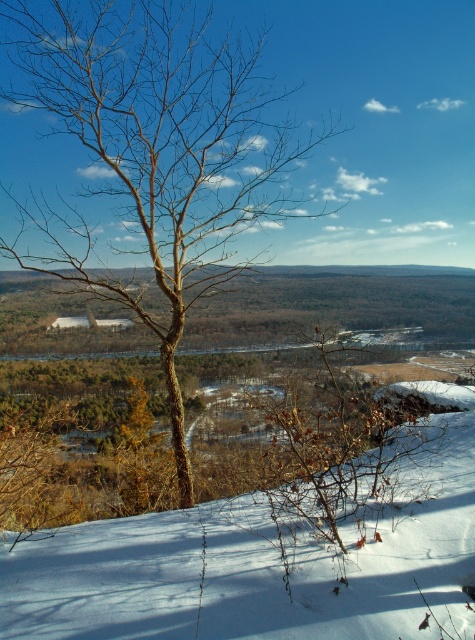
Between bare wood tree at center and white powdery snow at center, which one appears on the left side from the viewer's perspective?

bare wood tree at center

Between point (209, 118) and point (233, 512), which one is positioned behind?

Point (209, 118)

At what (x,y) coordinates should I click in order to perform the action: click on bare wood tree at center. Please return your answer as a coordinate pair (x, y). The height and width of the screenshot is (640, 475). Looking at the image, I should click on (152, 156).